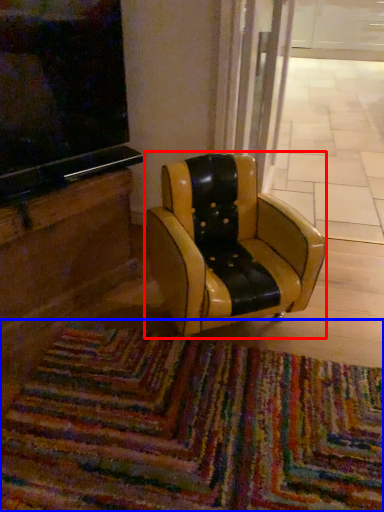
Question: Which point is further to the camera, chair (highlighted by a red box) or mat (highlighted by a blue box)?

Choices:
 (A) chair
 (B) mat

Answer: (A)